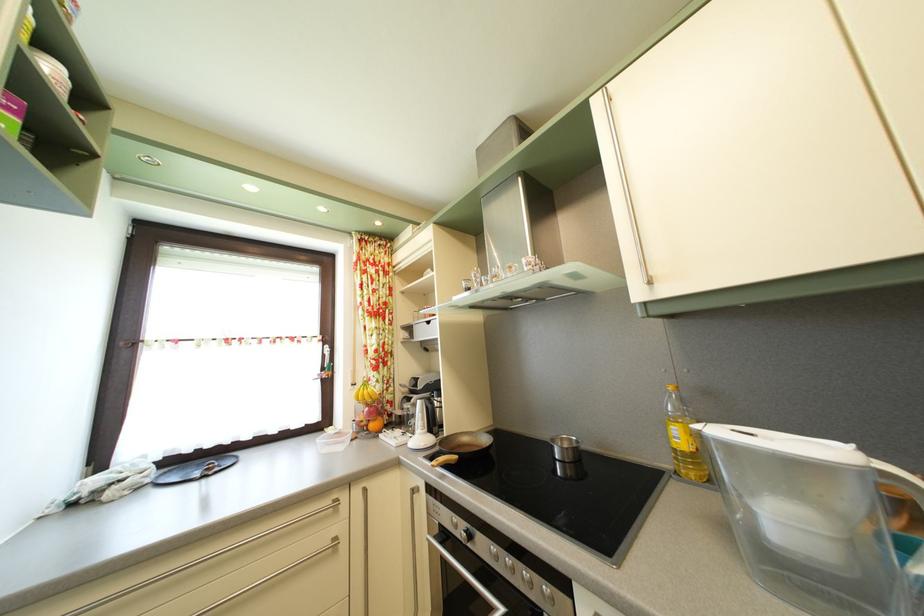
The image size is (924, 616). What do you see at coordinates (420, 428) in the screenshot?
I see `a white kettle handle` at bounding box center [420, 428].